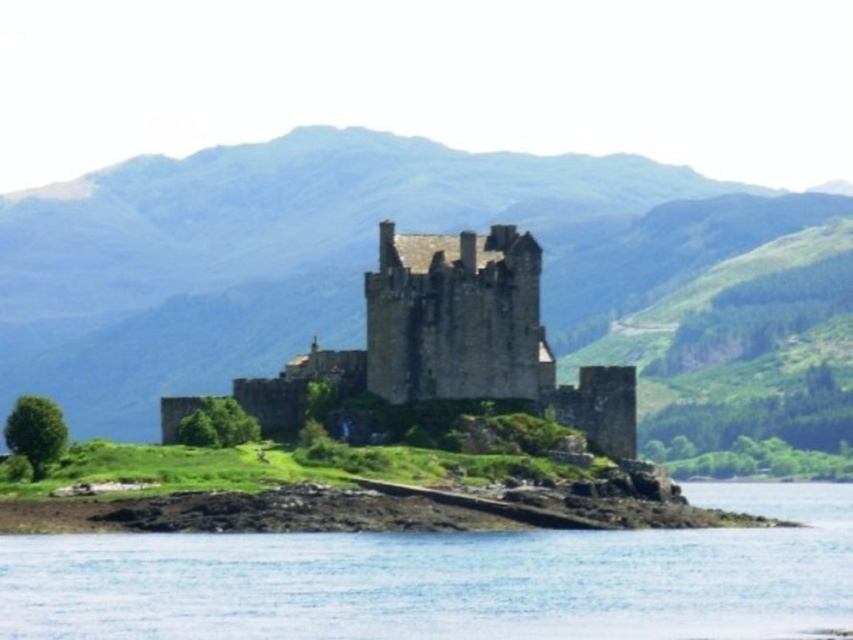
You are standing on the mainland looking at the castle on the island. There are two points marked on the image. Which point, point (518, 289) or point (498, 516), is closer to you?

Point (518, 289) is closer to you because it is further to the viewer than point (498, 516).

You are a visitor planning to take a boat tour around the clear blue water at lower center and the brown stone castle at center. Based on the scene, which object occupies a larger area in the image?

The clear blue water at lower center is bigger than the brown stone castle at center, so it occupies a larger area in the image.

You are a tourist planning to visit the historic stone castle. You see the clear blue water at lower center and the rocks at lower left. Which of these two features occupies a bigger area in the scene?

The clear blue water at lower center is larger in size than rocks at lower left, so the clear blue water at lower center occupies a bigger area in the scene.